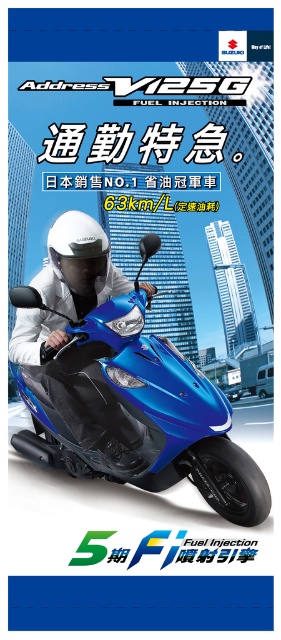
Can you confirm if glossy blue scooter at center is positioned to the left of matte blue helmet at upper left?

Indeed, glossy blue scooter at center is positioned on the left side of matte blue helmet at upper left.

Is point (114, 444) positioned before point (25, 316)?

Yes.

Between point (87, 368) and point (71, 420), which one is positioned behind?

Point (71, 420)

Locate an element on the screen. glossy blue scooter at center is located at coordinates (132, 408).